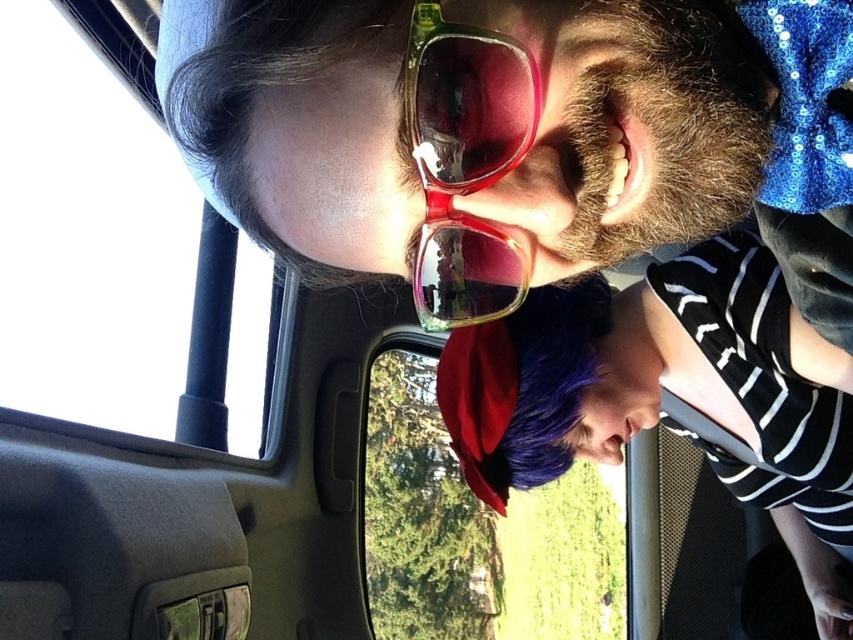
Can you confirm if matte plastic sunglasses at upper center is bigger than translucent plastic goggles at center?

Correct, matte plastic sunglasses at upper center is larger in size than translucent plastic goggles at center.

What do you see at coordinates (474, 134) in the screenshot? This screenshot has height=640, width=853. I see `matte plastic sunglasses at upper center` at bounding box center [474, 134].

The image size is (853, 640). In order to click on matte plastic sunglasses at upper center in this screenshot , I will do `click(474, 134)`.

Who is shorter, purple fabric cap at lower center or translucent plastic goggles at center?

translucent plastic goggles at center is shorter.

Which of these two, purple fabric cap at lower center or translucent plastic goggles at center, stands taller?

With more height is purple fabric cap at lower center.

The height and width of the screenshot is (640, 853). What do you see at coordinates (668, 388) in the screenshot?
I see `purple fabric cap at lower center` at bounding box center [668, 388].

The width and height of the screenshot is (853, 640). In order to click on purple fabric cap at lower center in this screenshot , I will do `click(668, 388)`.

Is matte plastic sunglasses at upper center taller than transparent plastic car window at lower center?

Incorrect, matte plastic sunglasses at upper center's height is not larger of transparent plastic car window at lower center's.

Who is more distant from viewer, (636, 189) or (514, 529)?

Point (514, 529)

Locate an element on the screen. matte plastic sunglasses at upper center is located at coordinates (474, 134).